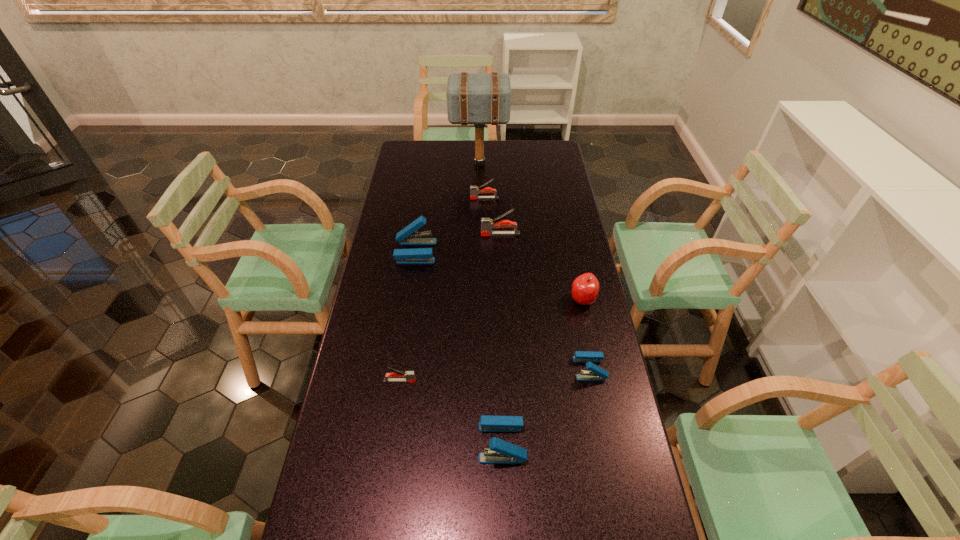
This screenshot has height=540, width=960. I want to click on blue stapler that is the closest to the second farthest object, so click(408, 236).

The height and width of the screenshot is (540, 960). Identify the location of free point that satisfies the following two spatial constraints: 1. on the back side of the second nearest blue stapler; 2. on the left side of the red apple. (576, 300).

Locate an element on the screen. vacant region that satisfies the following two spatial constraints: 1. on the handle side of the biggest gray stapler; 2. on the back side of the fourth nearest object is located at coordinates (504, 300).

Locate an element on the screen. This screenshot has width=960, height=540. blank area in the image that satisfies the following two spatial constraints: 1. on the back side of the nearest blue stapler; 2. on the handle side of the leftmost gray stapler is located at coordinates (500, 381).